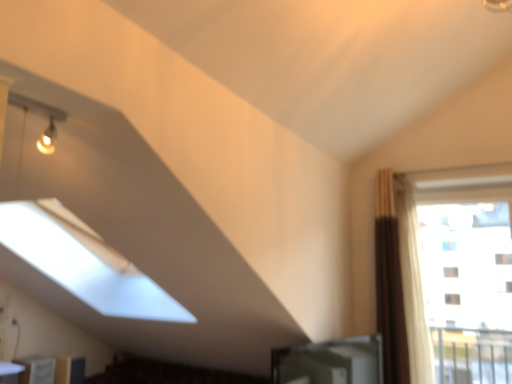
Question: From a real-world perspective, is transparent glass window at right positioned over white glossy table at lower left based on gravity?

Choices:
 (A) yes
 (B) no

Answer: (A)

Question: Is transparent glass window at right next to white glossy table at lower left?

Choices:
 (A) yes
 (B) no

Answer: (B)

Question: Could white glossy table at lower left be considered to be inside transparent glass window at right?

Choices:
 (A) no
 (B) yes

Answer: (A)

Question: Is transparent glass window at right positioned in front of white glossy table at lower left?

Choices:
 (A) yes
 (B) no

Answer: (B)

Question: Does transparent glass window at right have a smaller size compared to white glossy table at lower left?

Choices:
 (A) no
 (B) yes

Answer: (A)

Question: From the image's perspective, is transparent glass window at right under white glossy table at lower left?

Choices:
 (A) no
 (B) yes

Answer: (A)

Question: Is white glossy bookshelf at lower left, placed as the second furniture when sorted from back to front, far from matte wood cabinet at lower left, acting as the first furniture starting from the back?

Choices:
 (A) no
 (B) yes

Answer: (A)

Question: Considering the relative sizes of white glossy bookshelf at lower left, placed as the first furniture when sorted from front to back, and matte wood cabinet at lower left, marked as the second furniture in a front-to-back arrangement, in the image provided, is white glossy bookshelf at lower left, placed as the first furniture when sorted from front to back, thinner than matte wood cabinet at lower left, marked as the second furniture in a front-to-back arrangement,?

Choices:
 (A) yes
 (B) no

Answer: (A)

Question: Does white glossy bookshelf at lower left, placed as the first furniture when sorted from front to back, contain matte wood cabinet at lower left, marked as the second furniture in a front-to-back arrangement?

Choices:
 (A) yes
 (B) no

Answer: (B)

Question: From the image's perspective, is white glossy bookshelf at lower left, placed as the first furniture when sorted from front to back, below matte wood cabinet at lower left, marked as the second furniture in a front-to-back arrangement?

Choices:
 (A) yes
 (B) no

Answer: (B)

Question: Could you tell me if white glossy bookshelf at lower left, placed as the first furniture when sorted from front to back, is turned towards matte wood cabinet at lower left, acting as the first furniture starting from the back?

Choices:
 (A) yes
 (B) no

Answer: (B)

Question: From a real-world perspective, does white glossy bookshelf at lower left, placed as the second furniture when sorted from back to front, sit lower than matte wood cabinet at lower left, marked as the second furniture in a front-to-back arrangement?

Choices:
 (A) yes
 (B) no

Answer: (B)

Question: Is white glossy bookshelf at lower left, placed as the second furniture when sorted from back to front, not close to transparent glass window at right?

Choices:
 (A) yes
 (B) no

Answer: (A)